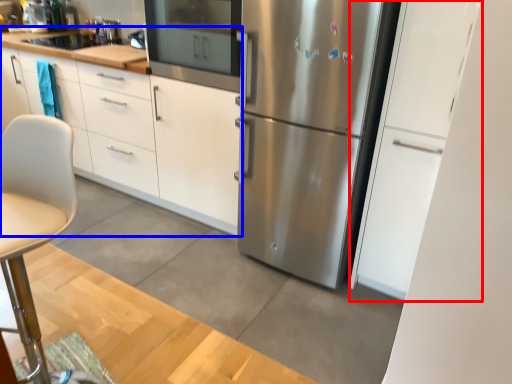
Question: Which point is further to the camera, cabinetry (highlighted by a red box) or cabinetry (highlighted by a blue box)?

Choices:
 (A) cabinetry
 (B) cabinetry

Answer: (B)